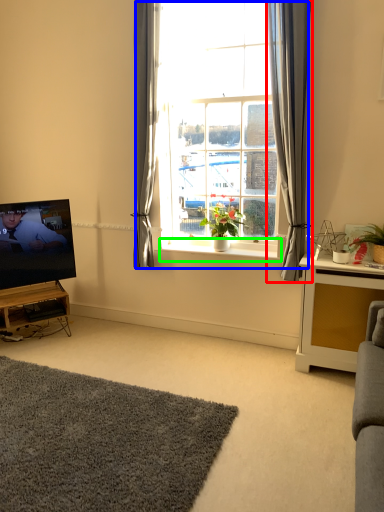
Question: Which object is positioned farthest from curtain (highlighted by a red box)? Select from window (highlighted by a blue box) and window sill (highlighted by a green box).

Choices:
 (A) window
 (B) window sill

Answer: (B)